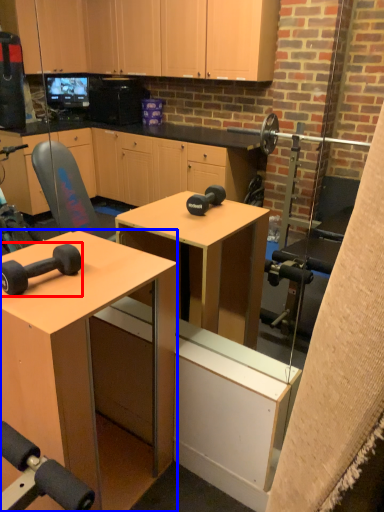
Question: Among these objects, which one is nearest to the camera, dumbbell (highlighted by a red box) or desk (highlighted by a blue box)?

Choices:
 (A) dumbbell
 (B) desk

Answer: (B)